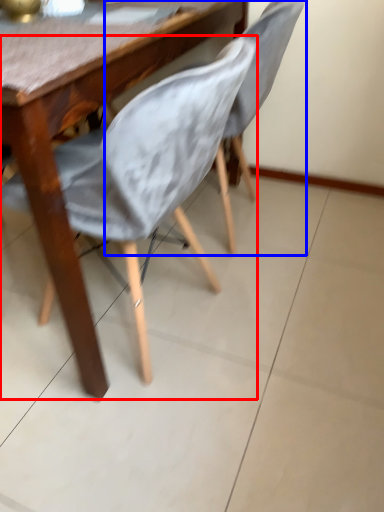
Question: Which object appears farthest to the camera in this image, chair (highlighted by a red box) or chair (highlighted by a blue box)?

Choices:
 (A) chair
 (B) chair

Answer: (B)